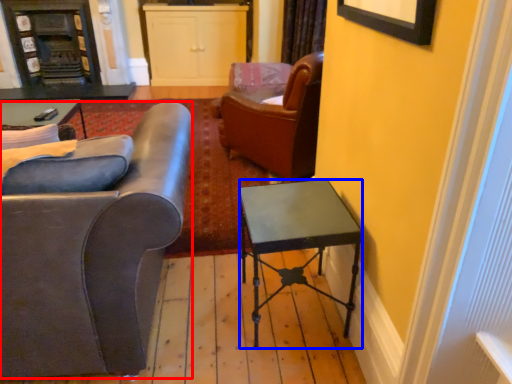
Question: Which object is further to the camera taking this photo, chair (highlighted by a red box) or desk (highlighted by a blue box)?

Choices:
 (A) chair
 (B) desk

Answer: (B)